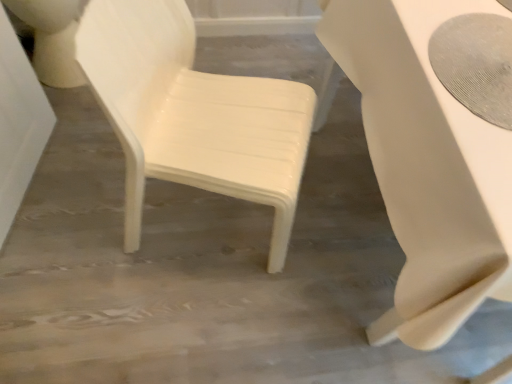
Question: Does white glossy toilet bowl at upper left have a greater height compared to white glossy chair at center?

Choices:
 (A) no
 (B) yes

Answer: (A)

Question: Could you tell me if white glossy toilet bowl at upper left is facing white glossy chair at center?

Choices:
 (A) yes
 (B) no

Answer: (B)

Question: Is white glossy chair at center at the back of white glossy toilet bowl at upper left?

Choices:
 (A) no
 (B) yes

Answer: (A)

Question: Does white glossy toilet bowl at upper left come in front of white glossy chair at center?

Choices:
 (A) no
 (B) yes

Answer: (A)

Question: From the image's perspective, is white glossy toilet bowl at upper left located above white glossy chair at center?

Choices:
 (A) yes
 (B) no

Answer: (A)

Question: From a real-world perspective, is white glossy toilet bowl at upper left below white glossy chair at center?

Choices:
 (A) no
 (B) yes

Answer: (B)

Question: Considering the relative sizes of white glossy chair at center and white glossy table at right in the image provided, is white glossy chair at center smaller than white glossy table at right?

Choices:
 (A) yes
 (B) no

Answer: (A)

Question: Can you confirm if white glossy chair at center is thinner than white glossy table at right?

Choices:
 (A) yes
 (B) no

Answer: (A)

Question: Is white glossy chair at center outside of white glossy table at right?

Choices:
 (A) no
 (B) yes

Answer: (B)

Question: From a real-world perspective, is white glossy chair at center positioned under white glossy table at right based on gravity?

Choices:
 (A) no
 (B) yes

Answer: (A)

Question: Could you tell me if white glossy chair at center is turned towards white glossy table at right?

Choices:
 (A) yes
 (B) no

Answer: (A)

Question: Is white glossy chair at center in contact with white glossy table at right?

Choices:
 (A) no
 (B) yes

Answer: (A)

Question: Would you say white glossy table at right is outside white glossy chair at center?

Choices:
 (A) no
 (B) yes

Answer: (B)